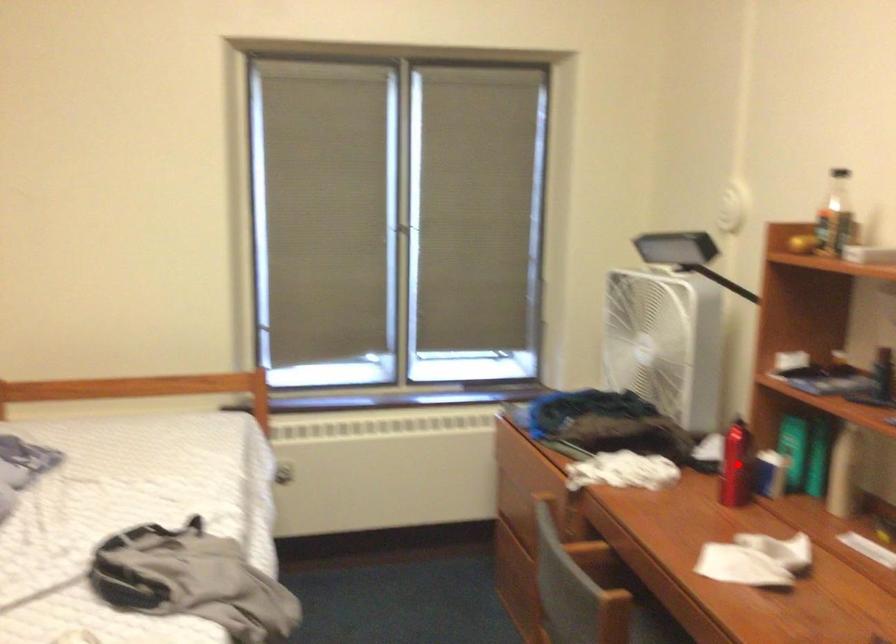
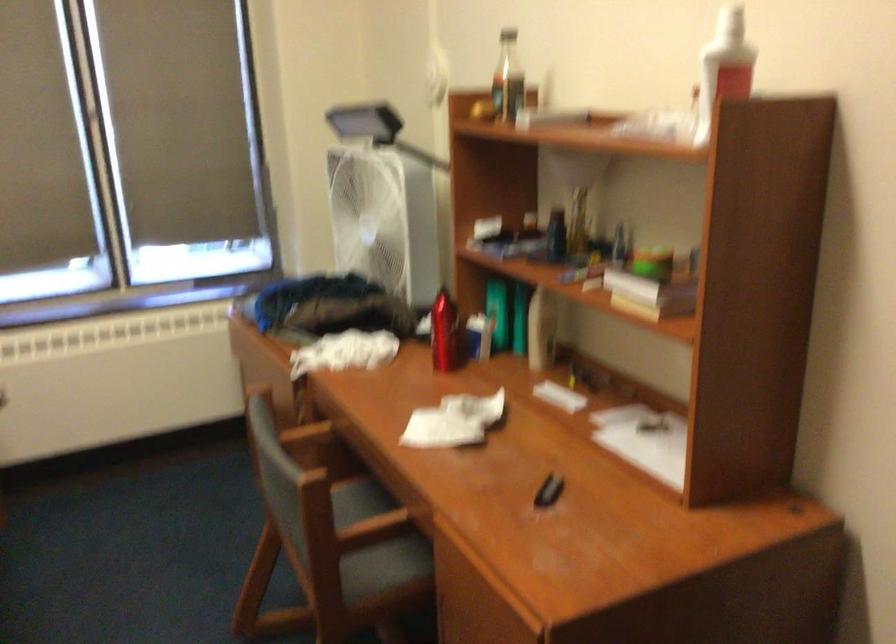
Locate, in the second image, the point that corresponds to the highlighted location in the first image.

(444, 333)